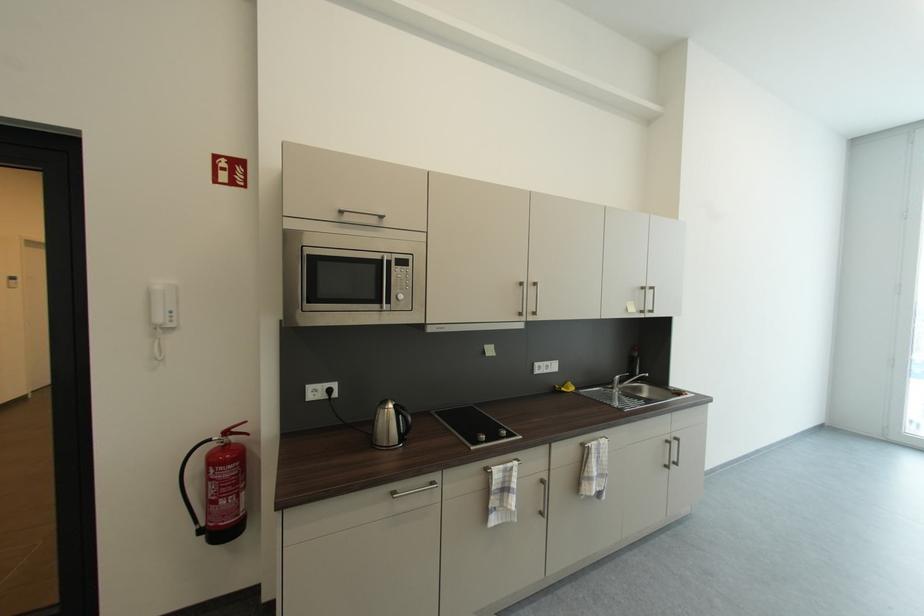
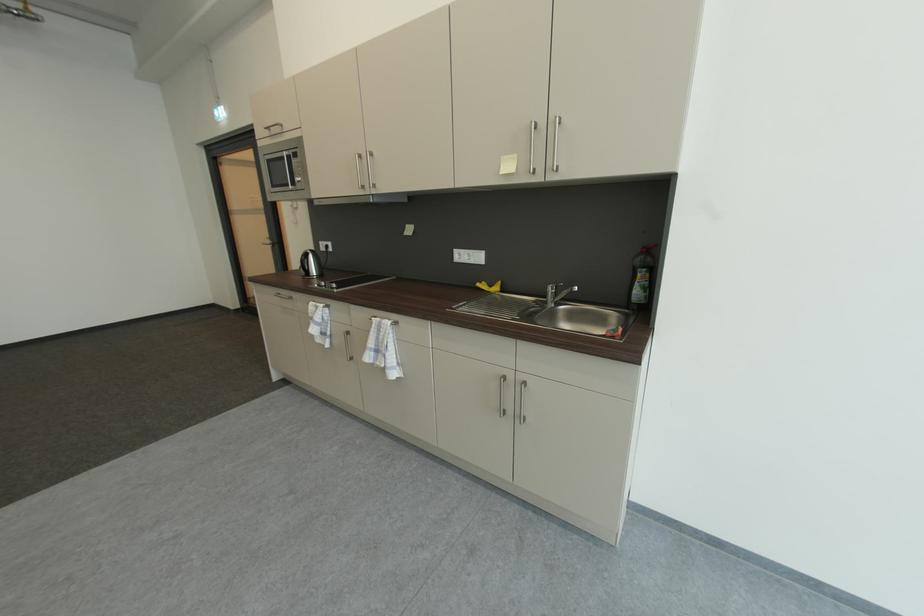
Locate, in the second image, the point that corresponds to the point at 388,262 in the first image.

(290, 158)